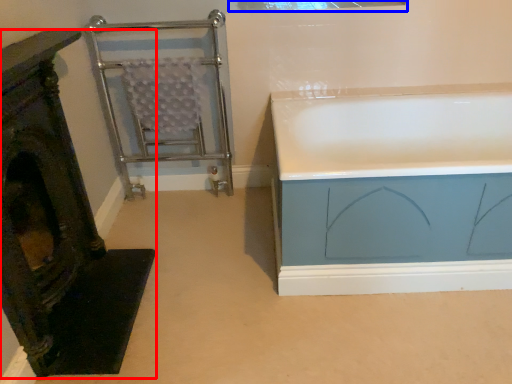
Question: Among these objects, which one is farthest to the camera, furniture (highlighted by a red box) or window (highlighted by a blue box)?

Choices:
 (A) furniture
 (B) window

Answer: (B)